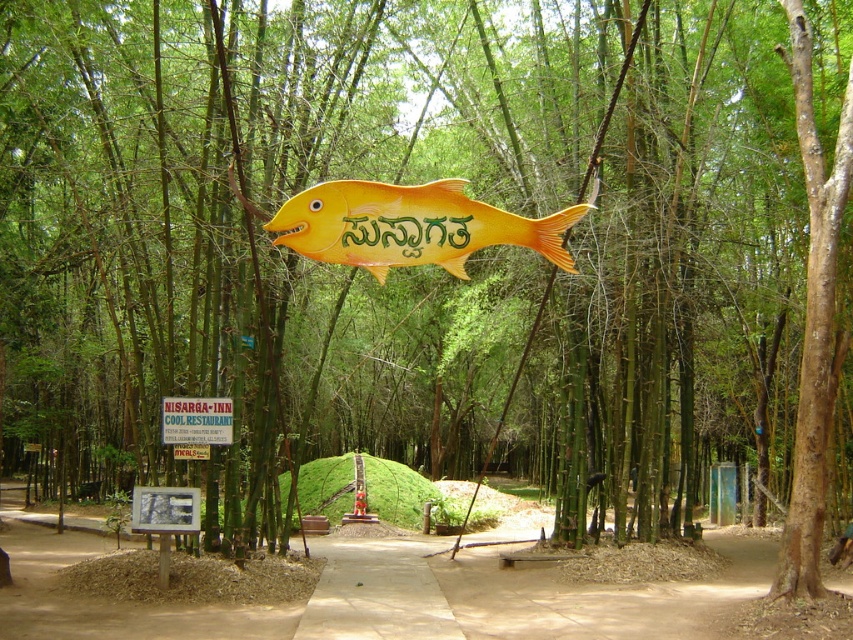
Is point (374, 237) less distant than point (196, 444)?

Yes, it is in front of point (196, 444).

Who is more distant from viewer, (430, 252) or (223, 420)?

Point (223, 420)

This screenshot has height=640, width=853. Find the location of `matte yellow fish at center`. matte yellow fish at center is located at coordinates (410, 225).

At what (x,y) coordinates should I click in order to perform the action: click on matte yellow fish at center. Please return your answer as a coordinate pair (x, y). Looking at the image, I should click on 410,225.